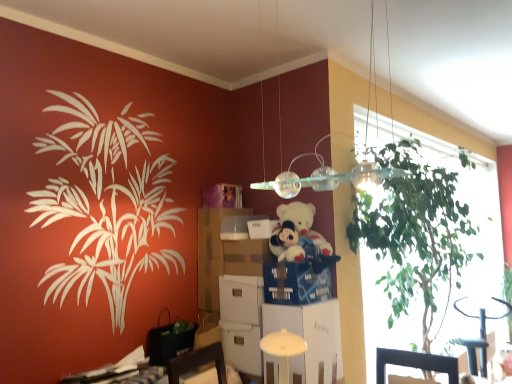
Question: Considering the relative sizes of white cardboard box at center, positioned as the 3th box in top-to-bottom order, and blue cardboard drawer at center, which appears as the 2th drawer when viewed from the left, in the image provided, is white cardboard box at center, positioned as the 3th box in top-to-bottom order, bigger than blue cardboard drawer at center, which appears as the 2th drawer when viewed from the left,?

Choices:
 (A) no
 (B) yes

Answer: (A)

Question: Is white cardboard box at center, which is the 1th box from bottom to top, turned away from blue cardboard drawer at center, marked as the first drawer in a right-to-left arrangement?

Choices:
 (A) yes
 (B) no

Answer: (B)

Question: Can you confirm if white cardboard box at center, positioned as the 3th box in top-to-bottom order, is positioned to the right of blue cardboard drawer at center, marked as the first drawer in a right-to-left arrangement?

Choices:
 (A) yes
 (B) no

Answer: (B)

Question: Could you tell me if white cardboard box at center, which is the 1th box from bottom to top, is facing blue cardboard drawer at center, which appears as the 2th drawer when viewed from the left?

Choices:
 (A) yes
 (B) no

Answer: (B)

Question: Can you confirm if white cardboard box at center, which is the 1th box from bottom to top, is wider than blue cardboard drawer at center, which appears as the 2th drawer when viewed from the left?

Choices:
 (A) no
 (B) yes

Answer: (A)

Question: Looking at the image, does white plush teddy bear at center seem bigger or smaller compared to white glossy round table at lower center?

Choices:
 (A) small
 (B) big

Answer: (A)

Question: Looking at their shapes, would you say white plush teddy bear at center is wider or thinner than white glossy round table at lower center?

Choices:
 (A) wide
 (B) thin

Answer: (B)

Question: Relative to white glossy round table at lower center, is white plush teddy bear at center in front or behind?

Choices:
 (A) front
 (B) behind

Answer: (A)

Question: From a real-world perspective, is white plush teddy bear at center physically located above or below white glossy round table at lower center?

Choices:
 (A) above
 (B) below

Answer: (A)

Question: Choose the correct answer: Is white cardboard box at center inside cardboard drawer at center, the 1th drawer viewed from the left, or outside it?

Choices:
 (A) outside
 (B) inside

Answer: (A)

Question: Is white cardboard box at center taller or shorter than cardboard drawer at center, the 1th drawer viewed from the left?

Choices:
 (A) short
 (B) tall

Answer: (B)

Question: From a real-world perspective, is white cardboard box at center positioned above or below cardboard drawer at center, the 1th drawer viewed from the left?

Choices:
 (A) above
 (B) below

Answer: (B)

Question: From the image's perspective, relative to cardboard drawer at center, the 1th drawer viewed from the left, is white cardboard box at center above or below?

Choices:
 (A) below
 (B) above

Answer: (A)

Question: Considering the relative positions of white cardboard box at center and white glossy round table at lower center in the image provided, is white cardboard box at center to the left or to the right of white glossy round table at lower center?

Choices:
 (A) left
 (B) right

Answer: (A)

Question: Is white cardboard box at center wider or thinner than white glossy round table at lower center?

Choices:
 (A) wide
 (B) thin

Answer: (B)